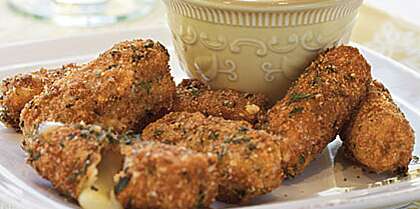
Locate an element on the screen. The width and height of the screenshot is (420, 209). table is located at coordinates (25, 30).